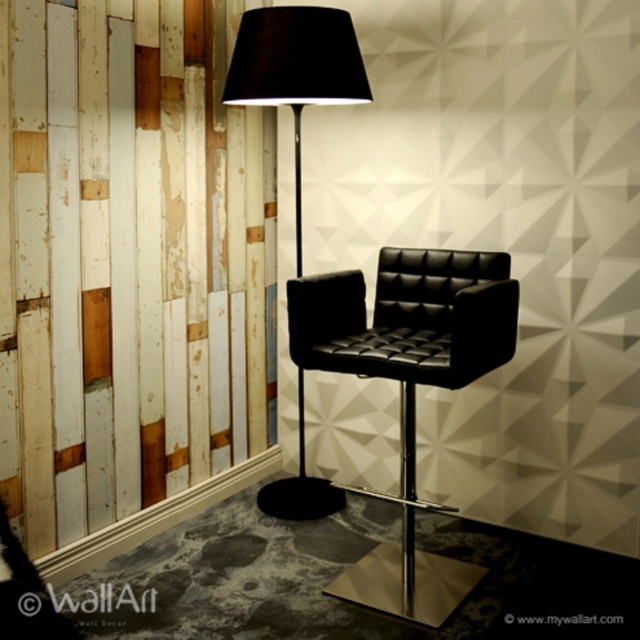
From the picture: Does black leather armchair at center have a larger size compared to black matte floor lamp at center?

Indeed, black leather armchair at center has a larger size compared to black matte floor lamp at center.

Does black leather armchair at center appear under black matte floor lamp at center?

Correct, black leather armchair at center is located below black matte floor lamp at center.

What do you see at coordinates (406, 387) in the screenshot? I see `black leather armchair at center` at bounding box center [406, 387].

This screenshot has height=640, width=640. Find the location of `black leather armchair at center`. black leather armchair at center is located at coordinates (406, 387).